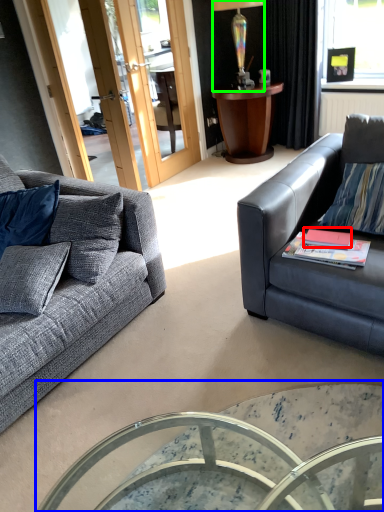
Question: Which object is the closest to the book (highlighted by a red box)? Choose among these: coffee table (highlighted by a blue box) or lamp (highlighted by a green box).

Choices:
 (A) coffee table
 (B) lamp

Answer: (A)